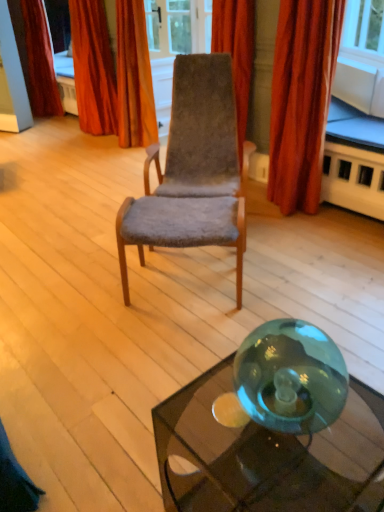
Question: Is velvet-like orange curtain at upper center, marked as the second curtain in a right-to-left arrangement, bigger than velvet-like red curtain at right, which is counted as the 1th curtain, starting from the right?

Choices:
 (A) yes
 (B) no

Answer: (B)

Question: Can you confirm if velvet-like orange curtain at upper center, acting as the 3th curtain starting from the left, is positioned to the left of velvet-like red curtain at right, which is counted as the 1th curtain, starting from the right?

Choices:
 (A) no
 (B) yes

Answer: (B)

Question: Is velvet-like orange curtain at upper center, marked as the second curtain in a right-to-left arrangement, at the right side of velvet-like red curtain at right, the 4th curtain viewed from the left?

Choices:
 (A) no
 (B) yes

Answer: (A)

Question: Is velvet-like orange curtain at upper center, marked as the second curtain in a right-to-left arrangement, taller than velvet-like red curtain at right, which is counted as the 1th curtain, starting from the right?

Choices:
 (A) yes
 (B) no

Answer: (A)

Question: Is velvet-like orange curtain at upper center, marked as the second curtain in a right-to-left arrangement, not close to velvet-like red curtain at right, which is counted as the 1th curtain, starting from the right?

Choices:
 (A) yes
 (B) no

Answer: (A)

Question: Considering the positions of velvet-like red curtain at upper left, arranged as the fourth curtain when viewed from the right, and transparent glass table at lower right, placed as the 1th table when sorted from back to front, in the image, is velvet-like red curtain at upper left, arranged as the fourth curtain when viewed from the right, taller or shorter than transparent glass table at lower right, placed as the 1th table when sorted from back to front,?

Choices:
 (A) short
 (B) tall

Answer: (B)

Question: Considering the positions of point (x=36, y=88) and point (x=321, y=188), is point (x=36, y=88) closer or farther from the camera than point (x=321, y=188)?

Choices:
 (A) farther
 (B) closer

Answer: (A)

Question: Considering the positions of velvet-like red curtain at upper left, marked as the first curtain in a left-to-right arrangement, and transparent glass table at lower right, arranged as the first table when viewed from the top, in the image, is velvet-like red curtain at upper left, marked as the first curtain in a left-to-right arrangement, bigger or smaller than transparent glass table at lower right, arranged as the first table when viewed from the top,?

Choices:
 (A) big
 (B) small

Answer: (A)

Question: Considering the positions of velvet-like red curtain at upper left, arranged as the fourth curtain when viewed from the right, and transparent glass table at lower right, the second table ordered from the bottom, in the image, is velvet-like red curtain at upper left, arranged as the fourth curtain when viewed from the right, wider or thinner than transparent glass table at lower right, the second table ordered from the bottom,?

Choices:
 (A) wide
 (B) thin

Answer: (B)

Question: Is velvet-like red curtain at upper left, positioned as the third curtain in right-to-left order, wider or thinner than velvet-like red curtain at upper left, marked as the first curtain in a left-to-right arrangement?

Choices:
 (A) wide
 (B) thin

Answer: (A)

Question: Would you say velvet-like red curtain at upper left, positioned as the third curtain in right-to-left order, is to the left or to the right of velvet-like red curtain at upper left, marked as the first curtain in a left-to-right arrangement, in the picture?

Choices:
 (A) left
 (B) right

Answer: (B)

Question: Is velvet-like red curtain at upper left, positioned as the third curtain in right-to-left order, taller or shorter than velvet-like red curtain at upper left, arranged as the fourth curtain when viewed from the right?

Choices:
 (A) short
 (B) tall

Answer: (A)

Question: From a real-world perspective, relative to velvet-like red curtain at upper left, marked as the first curtain in a left-to-right arrangement, is velvet-like red curtain at upper left, which appears as the 2th curtain when viewed from the left, vertically above or below?

Choices:
 (A) below
 (B) above

Answer: (A)

Question: Is velvet-like red curtain at upper left, marked as the first curtain in a left-to-right arrangement, wider or thinner than velvet-like red curtain at right, which is counted as the 1th curtain, starting from the right?

Choices:
 (A) thin
 (B) wide

Answer: (A)

Question: Considering the positions of point (44, 58) and point (281, 83), is point (44, 58) closer or farther from the camera than point (281, 83)?

Choices:
 (A) closer
 (B) farther

Answer: (B)